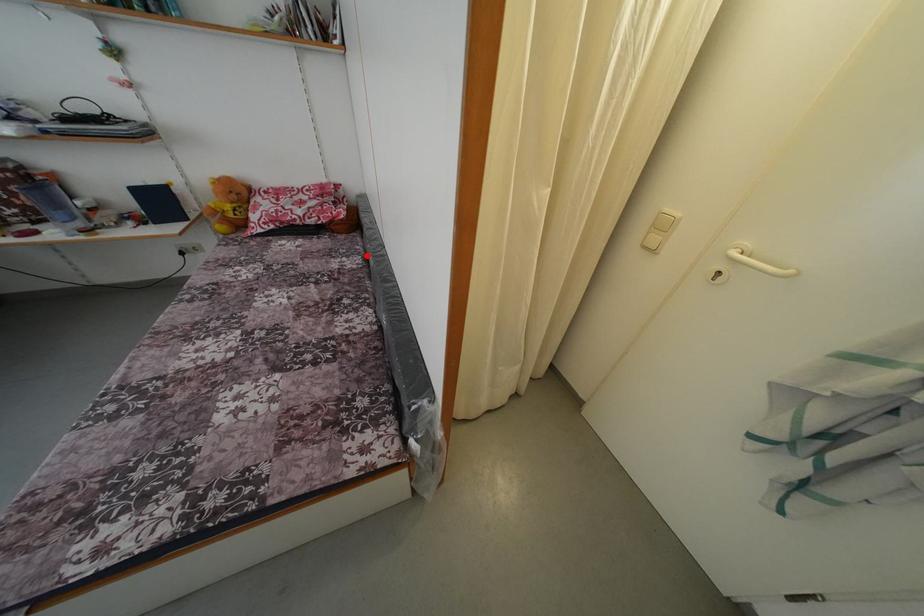
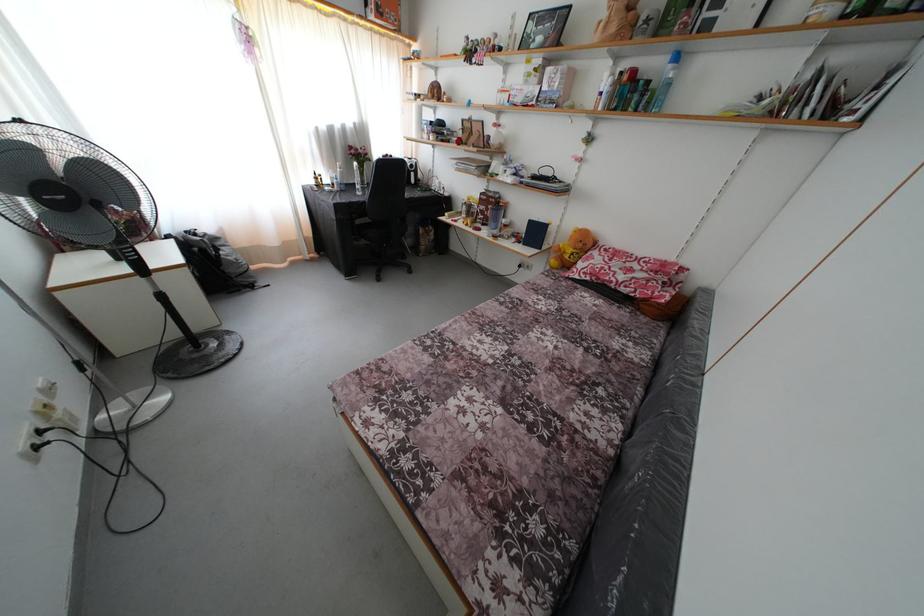
Question: I am providing you with two images of the same scene from different viewpoints. In image1, a red point is highlighted. Considering the same 3D point in image2, which of the following is correct?

Choices:
 (A) It is closer
 (B) It is farther

Answer: (A)